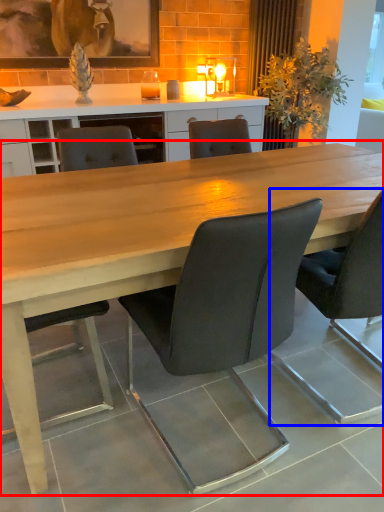
Question: Which of the following is the farthest to the observer, table (highlighted by a red box) or chair (highlighted by a blue box)?

Choices:
 (A) table
 (B) chair

Answer: (B)